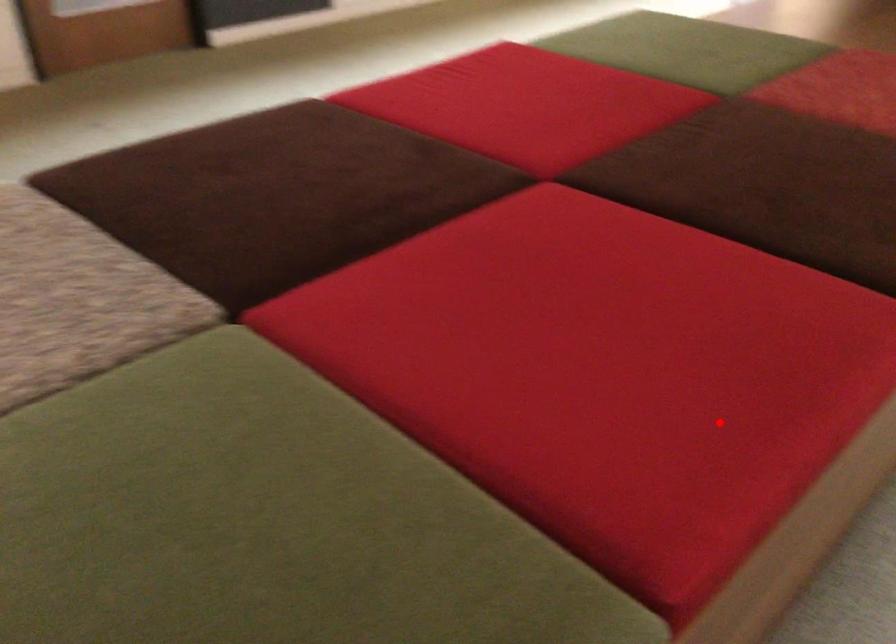
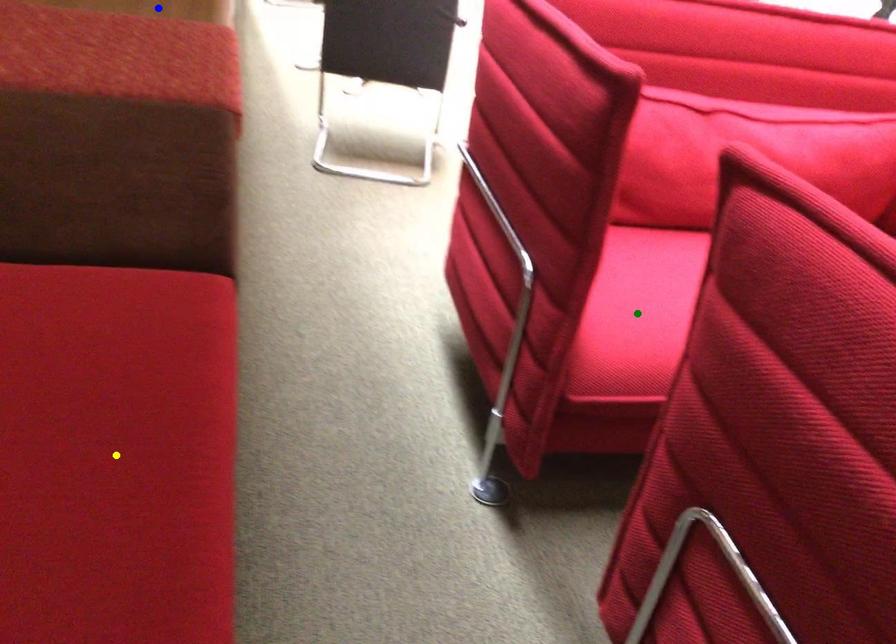
Question: I am providing you with two images of the same scene from different viewpoints. A red point is marked on the first image. You are given multiple points on the second image. Which mark in image 2 goes with the point in image 1?

Choices:
 (A) green point
 (B) blue point
 (C) yellow point

Answer: (C)